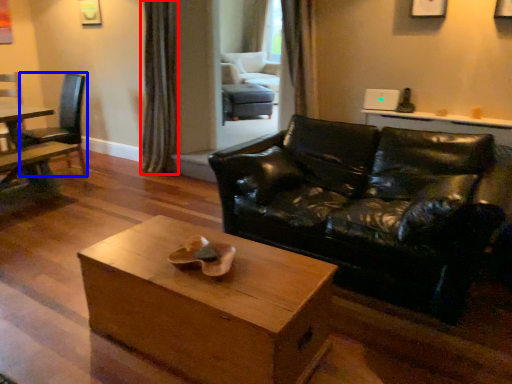
Question: Which point is further to the camera, curtain (highlighted by a red box) or chair (highlighted by a blue box)?

Choices:
 (A) curtain
 (B) chair

Answer: (A)